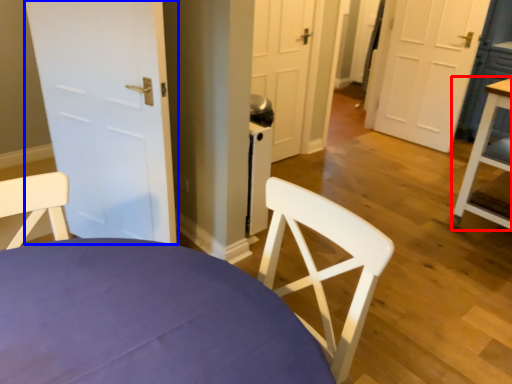
Question: Which object appears closest to the camera in this image, table (highlighted by a red box) or door (highlighted by a blue box)?

Choices:
 (A) table
 (B) door

Answer: (B)